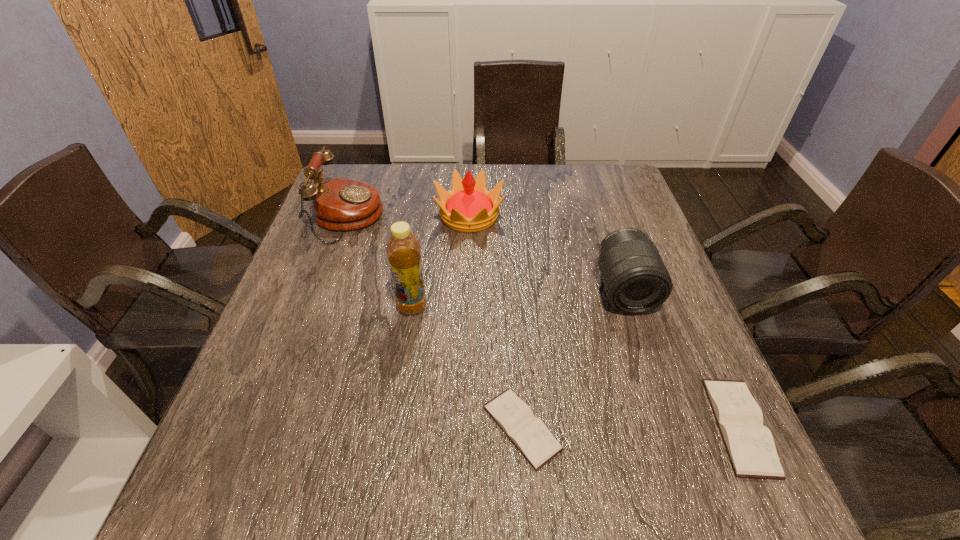
You are a GUI agent. You are given a task and a screenshot of the screen. Output one action in this format:
    pyautogui.click(x=<x>, y=<y>)
    Task: Click on the vacant space located on the left of the crown
    
    Given the screenshot: What is the action you would take?
    pyautogui.click(x=337, y=216)

You are a GUI agent. You are given a task and a screenshot of the screen. Output one action in this format:
    pyautogui.click(x=<x>, y=<y>)
    Task: Click on the vacant space located on the dial of the leftmost object
    This screenshot has height=540, width=960.
    Given the screenshot: What is the action you would take?
    pyautogui.click(x=494, y=218)

Image resolution: width=960 pixels, height=540 pixels. In order to click on vacant space positioned 0.340m on the right of the bottle in this screenshot , I will do `click(577, 307)`.

Where is `vacant space located 0.240m on the surface of the second object from right to left`? vacant space located 0.240m on the surface of the second object from right to left is located at coordinates (666, 416).

What are the coordinates of `crown present at the far edge` in the screenshot? It's located at (468, 207).

Identify the location of telephone present at the far edge. (340, 204).

At what (x,y) coordinates should I click in order to perform the action: click on object at the left edge. Please return your answer as a coordinate pair (x, y). The image size is (960, 540). Looking at the image, I should click on (340, 204).

You are a GUI agent. You are given a task and a screenshot of the screen. Output one action in this format:
    pyautogui.click(x=<x>, y=<y>)
    Task: Click on the diary that is at the right edge
    
    Given the screenshot: What is the action you would take?
    pyautogui.click(x=750, y=445)

You are a GUI agent. You are given a task and a screenshot of the screen. Output one action in this format:
    pyautogui.click(x=<x>, y=<y>)
    Task: Click on the telephoto lens that is at the right edge
    
    Given the screenshot: What is the action you would take?
    pyautogui.click(x=635, y=279)

Where is `object present at the far left corner`? object present at the far left corner is located at coordinates (340, 204).